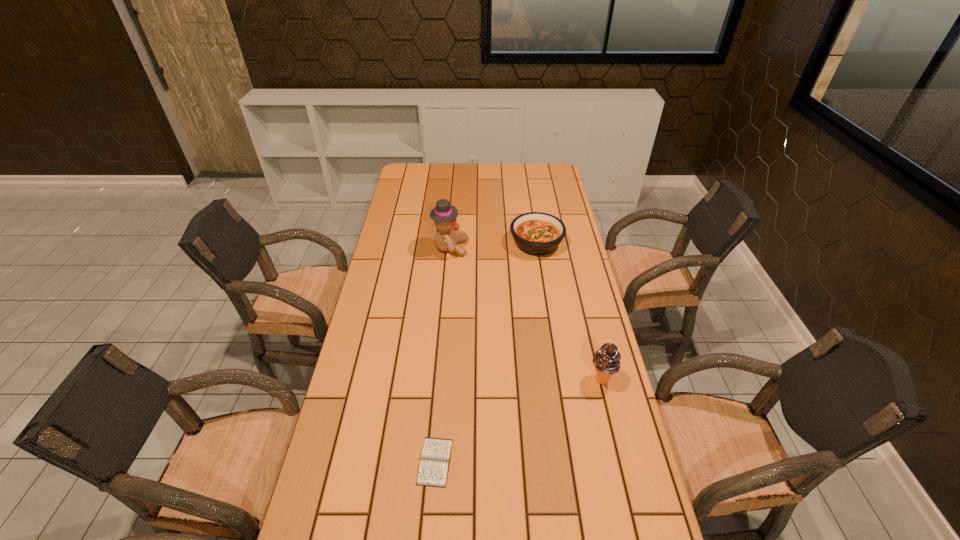
Locate an element on the screen. the tallest object is located at coordinates (444, 214).

Find the location of a particular element. the second nearest object is located at coordinates click(606, 360).

What are the coordinates of `icecream` in the screenshot? It's located at (606, 360).

This screenshot has width=960, height=540. Find the location of `the third tallest object`. the third tallest object is located at coordinates (535, 233).

Where is `diary`? diary is located at coordinates (433, 470).

Where is `the nearest object`? This screenshot has height=540, width=960. the nearest object is located at coordinates (433, 470).

You are a GUI agent. You are given a task and a screenshot of the screen. Output one action in this format:
    pyautogui.click(x=<x>, y=<y>)
    Task: Click on the vacant space located 0.350m on the front-facing side of the tallest object
    
    Given the screenshot: What is the action you would take?
    pyautogui.click(x=556, y=248)

In order to click on vacant region located on the back of the second nearest object in this screenshot , I will do `click(583, 302)`.

The image size is (960, 540). I want to click on free spot located on the left of the stew, so (x=452, y=243).

Where is `free space located on the back of the shortest object`? free space located on the back of the shortest object is located at coordinates (444, 335).